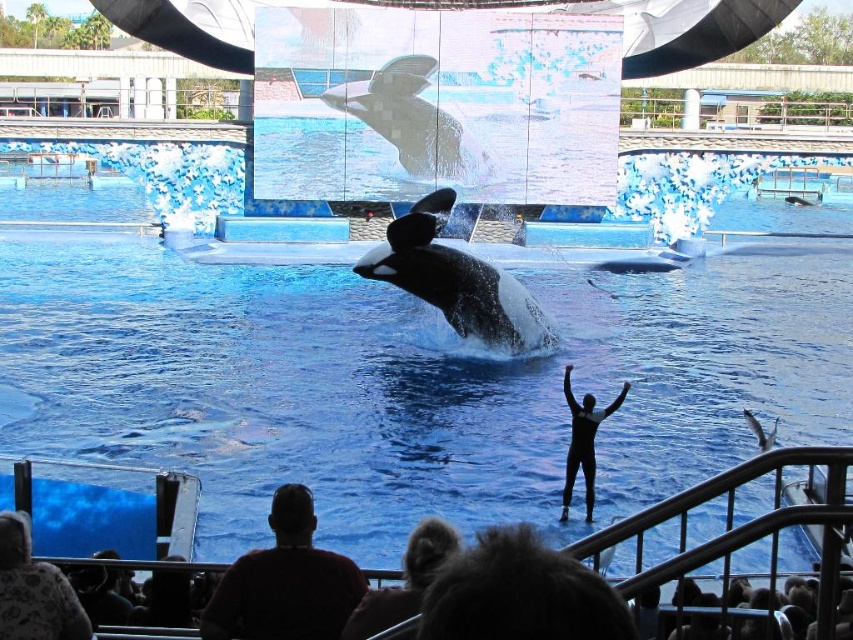
Does dark red sweater at lower center lie in front of fluffy white sweater at lower left?

No, dark red sweater at lower center is further to the viewer.

Can you confirm if dark red sweater at lower center is bigger than fluffy white sweater at lower left?

Incorrect, dark red sweater at lower center is not larger than fluffy white sweater at lower left.

Is point (328, 561) positioned in front of point (33, 602)?

No, it is behind (33, 602).

This screenshot has width=853, height=640. I want to click on dark red sweater at lower center, so click(x=285, y=580).

Is point (485, 332) in front of point (602, 266)?

Yes, it is in front of point (602, 266).

Which is behind, point (447, 294) or point (654, 259)?

Positioned behind is point (654, 259).

Between point (418, 291) and point (660, 260), which one is positioned in front?

Point (418, 291)

The image size is (853, 640). In order to click on black smooth whale at center in this screenshot , I will do `click(456, 280)`.

Identify the location of dark brown hair at lower center. (404, 580).

Is dark brown hair at lower center below black smooth dolphin at center?

Yes.

Does point (361, 600) come farther from viewer compared to point (651, 262)?

No.

The image size is (853, 640). I want to click on dark brown hair at lower center, so click(x=404, y=580).